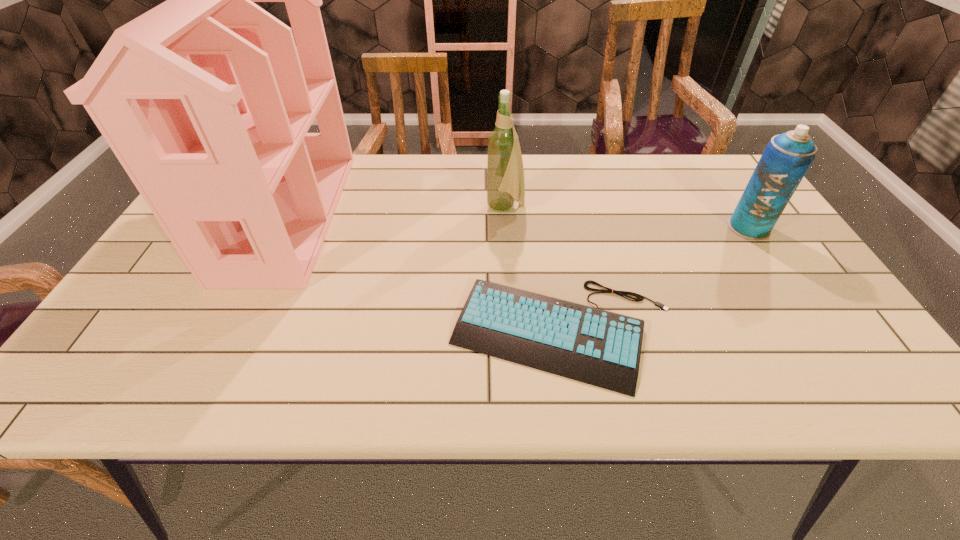
The width and height of the screenshot is (960, 540). I want to click on vacant point that satisfies the following two spatial constraints: 1. on the front-facing side of the third tallest object; 2. on the left side of the wine bottle, so click(x=507, y=228).

At what (x,y) coordinates should I click in order to perform the action: click on vacant space that satisfies the following two spatial constraints: 1. on the back side of the rightmost object; 2. on the front-facing side of the wine bottle. Please return your answer as a coordinate pair (x, y). Looking at the image, I should click on (736, 208).

In order to click on blank area in the image that satisfies the following two spatial constraints: 1. on the back side of the shortest object; 2. on the front-facing side of the dollhouse in this screenshot , I will do `click(544, 215)`.

At what (x,y) coordinates should I click in order to perform the action: click on vacant position in the image that satisfies the following two spatial constraints: 1. on the back side of the computer keyboard; 2. on the front-facing side of the wine bottle. Please return your answer as a coordinate pair (x, y). This screenshot has width=960, height=540. Looking at the image, I should click on (543, 208).

Identify the location of free region that satisfies the following two spatial constraints: 1. on the front-facing side of the third tallest object; 2. on the right side of the wine bottle. The width and height of the screenshot is (960, 540). (507, 228).

This screenshot has height=540, width=960. What are the coordinates of `free space that satisfies the following two spatial constraints: 1. on the front-facing side of the leftmost object; 2. on the left side of the shortest object` in the screenshot? It's located at pos(232,333).